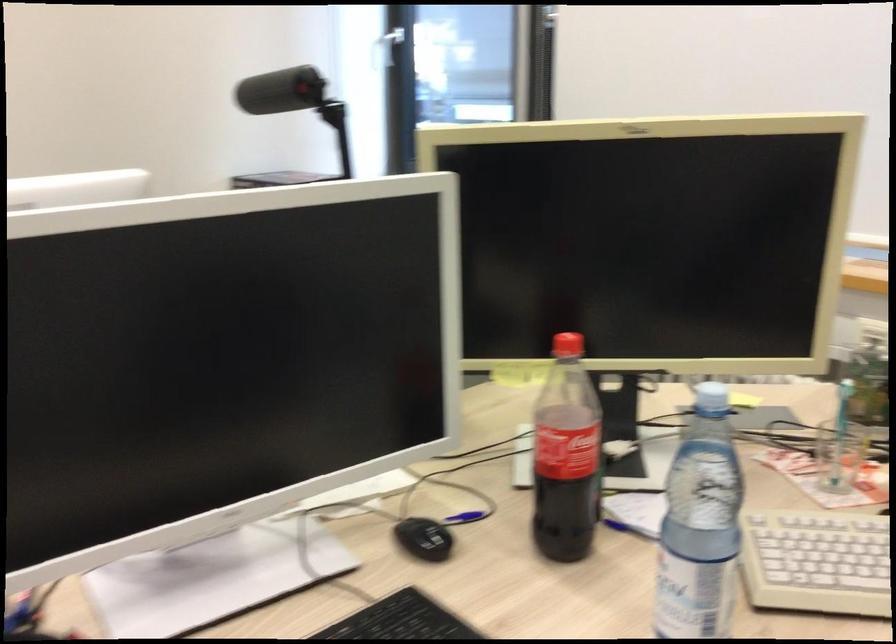
Find the location of `clear glass cup`. clear glass cup is located at coordinates (839, 456).